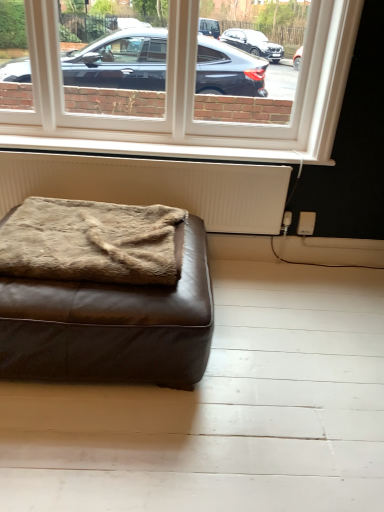
This screenshot has width=384, height=512. I want to click on empty space that is ontop of white painted wood at lower center, so click(144, 138).